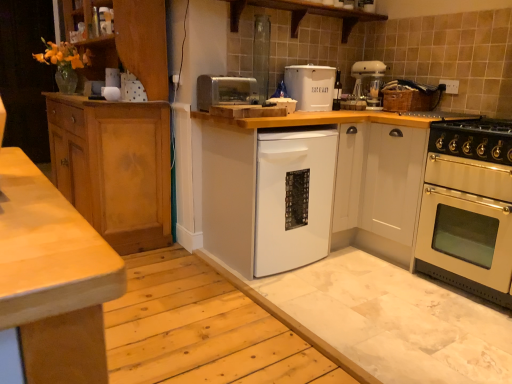
Question: From the image's perspective, relative to white glossy cabinet at right, the third cabinetry viewed from the left, is white plastic mixer at upper right above or below?

Choices:
 (A) above
 (B) below

Answer: (A)

Question: Looking at the image, does white plastic mixer at upper right seem bigger or smaller compared to white glossy cabinet at right, the third cabinetry viewed from the left?

Choices:
 (A) small
 (B) big

Answer: (A)

Question: Which is farther from the stainless steel oven at right?

Choices:
 (A) silver metallic toaster at center
 (B) gold metallic gas stove at right
 (C) white glossy cabinet at right, acting as the 1th cabinetry starting from the right
 (D) light brown wood cabinet at left, the 3th cabinetry when ordered from right to left
 (E) white matte dishwasher at center, arranged as the second cabinetry when viewed from the right

Answer: (D)

Question: Which object is positioned farthest from the white matte bread bin at center?

Choices:
 (A) white glossy cabinet at right, acting as the 1th cabinetry starting from the right
 (B) gold metallic gas stove at right
 (C) wooden at upper center
 (D) white matte dishwasher at center
 (E) silver metallic toaster at center

Answer: (B)